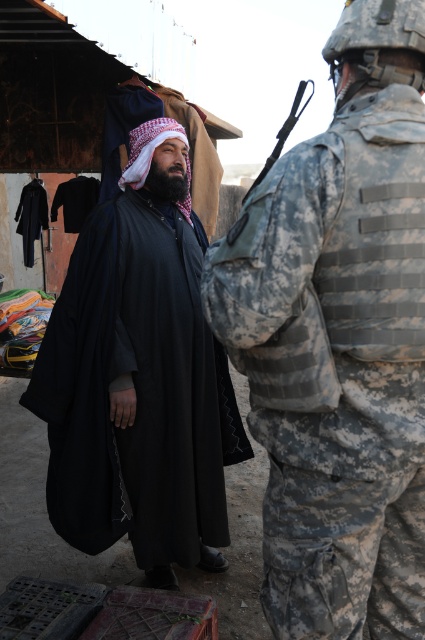
Does point (314, 227) come behind point (197, 330)?

No, (314, 227) is in front of (197, 330).

Does point (379, 502) come behind point (122, 259)?

No, it is in front of (122, 259).

Where is `camouflage uniform at right`? camouflage uniform at right is located at coordinates (339, 340).